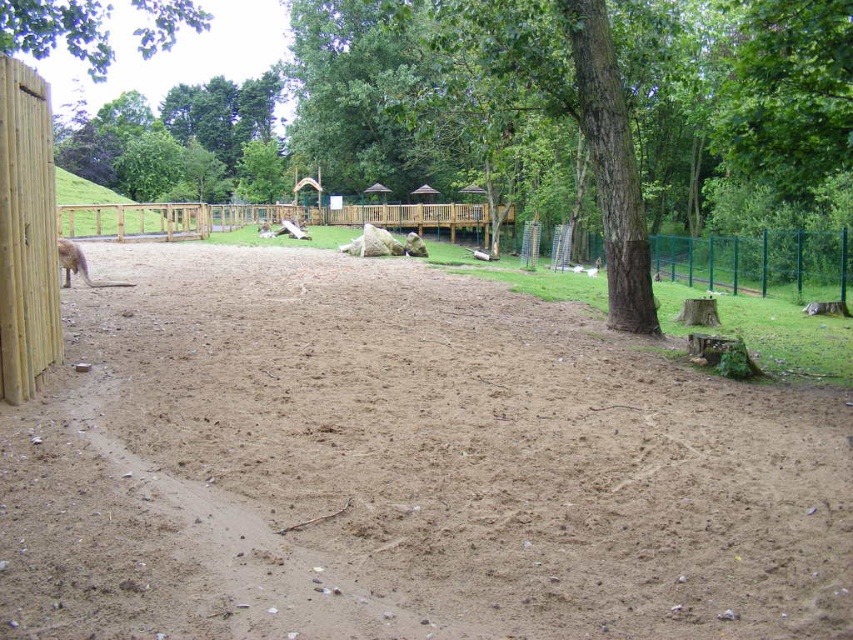
Question: Estimate the real-world distances between objects in this image. Which object is closer to the brown sandy dirt field at center?

Choices:
 (A) green leafy tree at upper left
 (B) brown furry kangaroo at left

Answer: (B)

Question: Is green leafy tree at upper left behind brown furry kangaroo at left?

Choices:
 (A) yes
 (B) no

Answer: (B)

Question: Can you confirm if brown sandy dirt field at center is positioned to the right of green leafy tree at upper left?

Choices:
 (A) yes
 (B) no

Answer: (A)

Question: Which object is positioned farthest from the brown sandy dirt field at center?

Choices:
 (A) green leafy tree at upper left
 (B) brown furry kangaroo at left

Answer: (A)

Question: Is green leafy tree at upper left positioned at the back of brown furry kangaroo at left?

Choices:
 (A) no
 (B) yes

Answer: (A)

Question: Which of the following is the closest to the observer?

Choices:
 (A) brown sandy dirt field at center
 (B) brown furry kangaroo at left

Answer: (A)